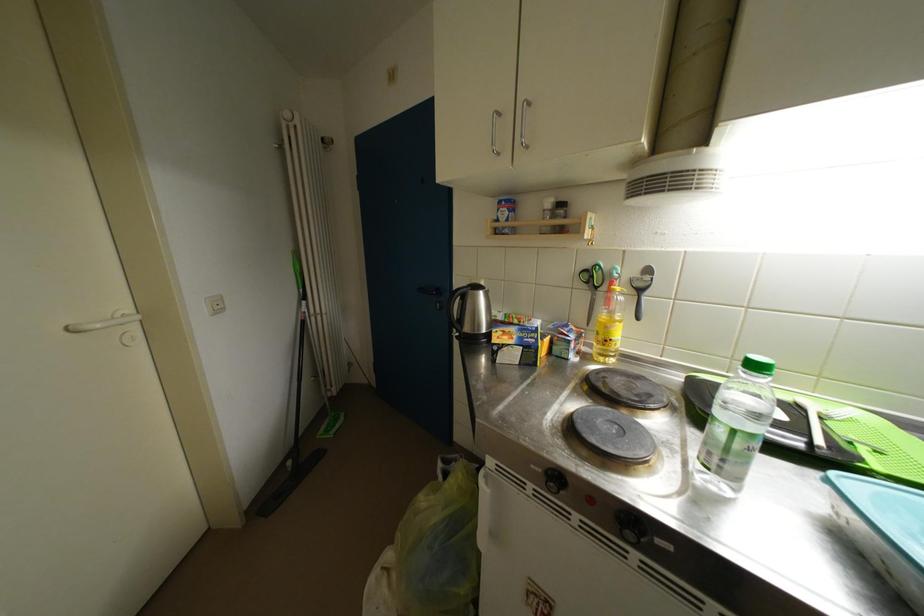
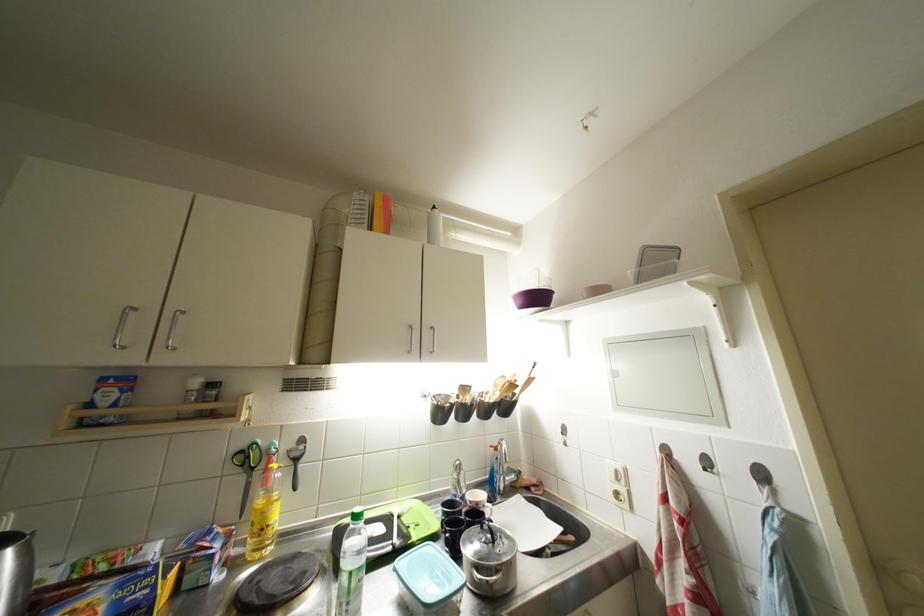
The point at [744,450] is marked in the first image. Where is the corresponding point in the second image?

(359, 589)